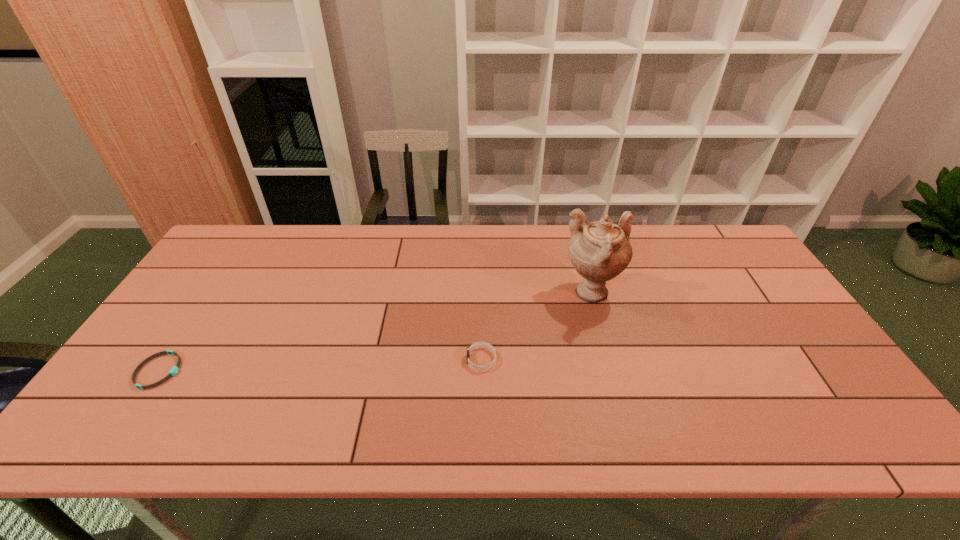
At what (x,y) coordinates should I click in order to perform the action: click on vacant space that is in between the tallest object and the leftmost object. Please return your answer as a coordinate pair (x, y). The image size is (960, 540). Looking at the image, I should click on (375, 333).

Image resolution: width=960 pixels, height=540 pixels. What are the coordinates of `empty space that is in between the second object from right to left and the left wristband` in the screenshot? It's located at (321, 365).

The height and width of the screenshot is (540, 960). In order to click on vacant space in between the second tallest object and the shortest object in this screenshot , I will do `click(321, 365)`.

Locate an element on the screen. The width and height of the screenshot is (960, 540). blank region between the shortest object and the second object from left to right is located at coordinates (321, 365).

I want to click on blank region between the shorter wristband and the second object from right to left, so click(321, 365).

You are a GUI agent. You are given a task and a screenshot of the screen. Output one action in this format:
    pyautogui.click(x=<x>, y=<y>)
    Task: Click on the blank region between the farthest object and the leftmost object
    Image resolution: width=960 pixels, height=540 pixels.
    Given the screenshot: What is the action you would take?
    pyautogui.click(x=375, y=333)

Find the location of a particular element. Image resolution: width=960 pixels, height=540 pixels. object identified as the second closest to the second shortest object is located at coordinates (174, 370).

Find the location of a particular element. The height and width of the screenshot is (540, 960). the closest object to the shortest object is located at coordinates click(478, 344).

The height and width of the screenshot is (540, 960). I want to click on vacant region that satisfies the following two spatial constraints: 1. on the front side of the rightmost object; 2. on the outer surface of the second object from left to right, so click(x=610, y=359).

Locate an element on the screen. The width and height of the screenshot is (960, 540). free space that satisfies the following two spatial constraints: 1. on the front side of the rightmost object; 2. on the buckle of the shorter wristband is located at coordinates (613, 371).